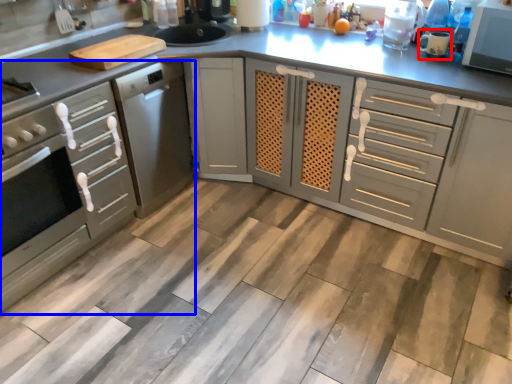
Question: Which object appears closest to the camera in this image, appliance (highlighted by a red box) or cabinetry (highlighted by a blue box)?

Choices:
 (A) appliance
 (B) cabinetry

Answer: (B)